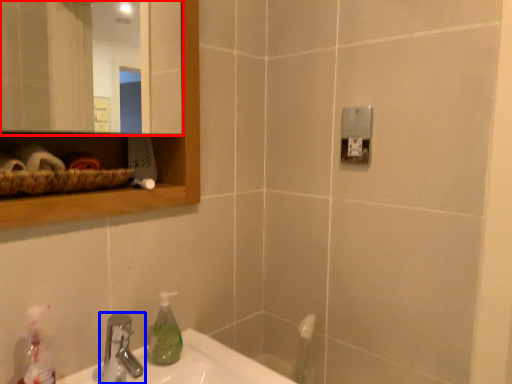
Question: Which object appears farthest to the camera in this image, mirror (highlighted by a red box) or tap (highlighted by a blue box)?

Choices:
 (A) mirror
 (B) tap

Answer: (B)